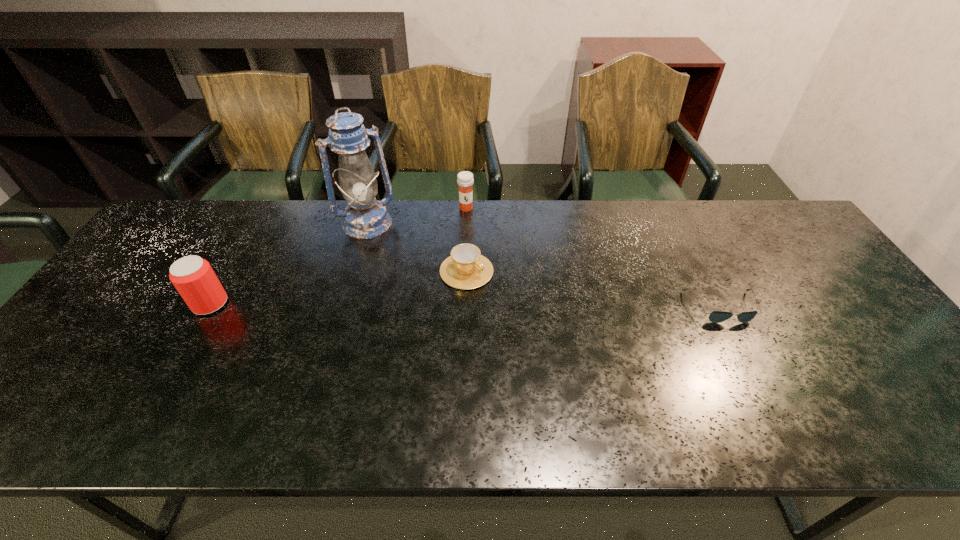
Locate an element on the screen. vacant space situated on the front-facing side of the second object from left to right is located at coordinates (393, 267).

Where is `free region located on the front-facing side of the second object from left to right`? This screenshot has width=960, height=540. free region located on the front-facing side of the second object from left to right is located at coordinates (410, 299).

Where is `free space located 0.050m on the front-facing side of the second object from left to right`? This screenshot has height=540, width=960. free space located 0.050m on the front-facing side of the second object from left to right is located at coordinates (381, 247).

Image resolution: width=960 pixels, height=540 pixels. Find the location of `free space located with the handle on the side of the third nearest object`. free space located with the handle on the side of the third nearest object is located at coordinates (541, 315).

Locate an element on the screen. The height and width of the screenshot is (540, 960). free space located 0.200m with the handle on the side of the third nearest object is located at coordinates (548, 319).

Locate an element on the screen. free space located with the handle on the side of the third nearest object is located at coordinates (519, 302).

This screenshot has height=540, width=960. In order to click on vacant space situated 0.070m on the label side of the medicine in this screenshot , I will do `click(465, 226)`.

Identify the location of vacant space located 0.290m on the label side of the medicine. (459, 275).

Identify the location of vacant point located on the label side of the medicine. This screenshot has height=540, width=960. (465, 224).

The width and height of the screenshot is (960, 540). I want to click on lantern that is at the far edge, so click(x=365, y=217).